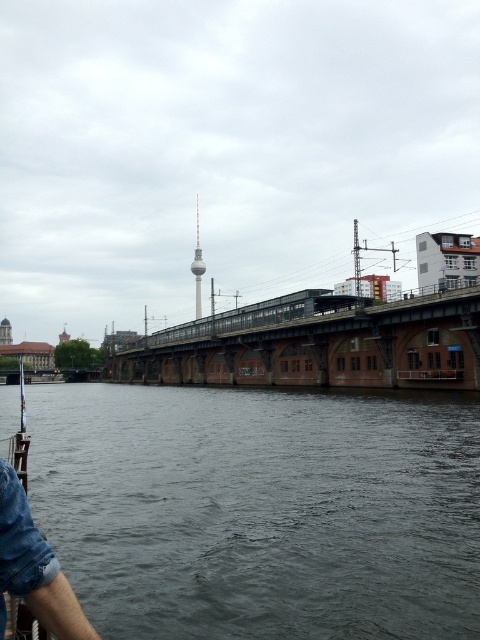
You are standing at the point marked by the coordinates point (261,509) on the image. What is the immediate surface you are standing on?

The dark gray water at lower center is represented by point (261,509), so you are standing on dark gray water at lower center.

You are a drone operator trying to capture the Berlin TV Tower from above the dark gray water at lower center. Based on the 2D coordinates provided, what is the exact position you should aim for to ensure the tower is centered in your shot?

The dark gray water at lower center is located at the 2D coordinates point (261, 509), so you should aim your drone at that point to center the Berlin TV Tower in your shot.